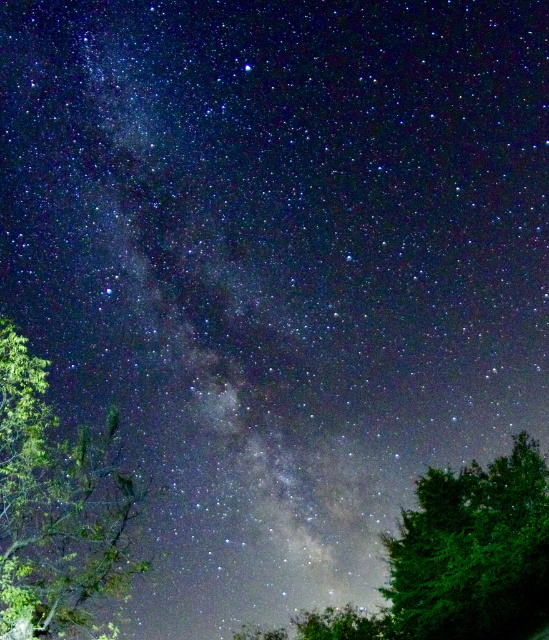
Question: Is green leafy tree at lower left smaller than green leafy tree at lower right?

Choices:
 (A) no
 (B) yes

Answer: (B)

Question: Can you confirm if green leafy tree at lower left is bigger than green leafy tree at lower right?

Choices:
 (A) yes
 (B) no

Answer: (B)

Question: Observing the image, what is the correct spatial positioning of green leafy tree at lower left in reference to green leafy tree at lower right?

Choices:
 (A) left
 (B) right

Answer: (A)

Question: Among these points, which one is nearest to the camera?

Choices:
 (A) pyautogui.click(x=42, y=428)
 (B) pyautogui.click(x=542, y=580)

Answer: (A)